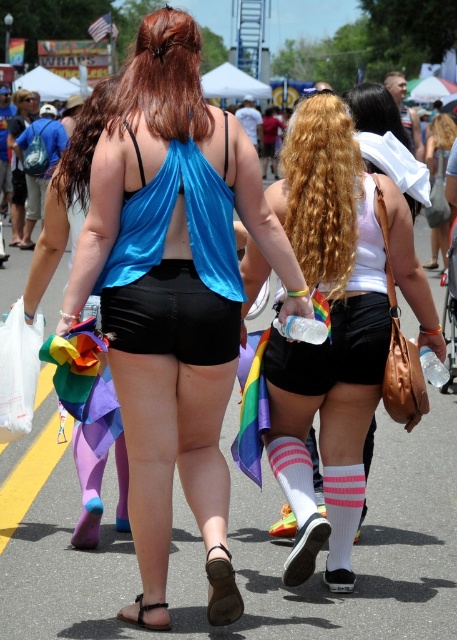
Is curly blonde hair at center in front of black matte shorts at center?

No.

Does curly blonde hair at center appear under black matte shorts at center?

Incorrect, curly blonde hair at center is not positioned below black matte shorts at center.

Does point (346, 164) lie in front of point (165, 333)?

No, (346, 164) is behind (165, 333).

Locate an element on the screen. This screenshot has width=457, height=640. curly blonde hair at center is located at coordinates (323, 189).

Does blue satin tank top at center come in front of white matte tank top at center?

Yes, it is in front of white matte tank top at center.

Based on the photo, can you confirm if blue satin tank top at center is positioned to the right of white matte tank top at center?

No, blue satin tank top at center is not to the right of white matte tank top at center.

Measure the distance between blue satin tank top at center and camera.

4.02 meters

Where is `blue satin tank top at center`? Image resolution: width=457 pixels, height=640 pixels. blue satin tank top at center is located at coordinates (174, 294).

Which is more to the right, black matte shorts at center or curly blonde hair at upper center?

Positioned to the right is curly blonde hair at upper center.

Consider the image. Does black matte shorts at center have a larger size compared to curly blonde hair at upper center?

Yes, black matte shorts at center is bigger than curly blonde hair at upper center.

Does point (134, 298) come closer to viewer compared to point (388, 112)?

Yes, it is.

Where is `black matte shorts at center`? This screenshot has height=640, width=457. black matte shorts at center is located at coordinates (171, 316).